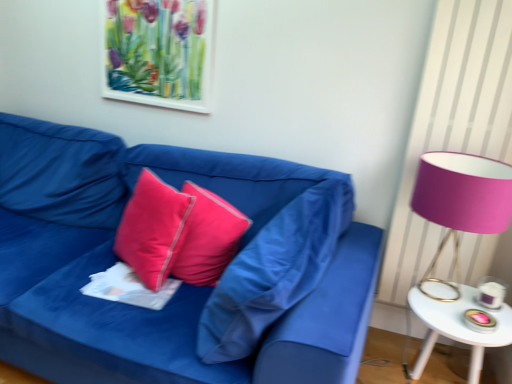
Question: Which direction should I rotate to look at matte pink pillow at center, which appears as the 1th pillow when viewed from the right, — up or down?

Choices:
 (A) down
 (B) up

Answer: (A)

Question: From the image's perspective, would you say satin pink pillow at center, acting as the 1th pillow starting from the left, is positioned over matte blue fabric couch at center?

Choices:
 (A) no
 (B) yes

Answer: (B)

Question: Could you tell me if satin pink pillow at center, the 3th pillow when ordered from right to left, is facing matte blue fabric couch at center?

Choices:
 (A) yes
 (B) no

Answer: (A)

Question: Can you confirm if satin pink pillow at center, acting as the 1th pillow starting from the left, is shorter than matte blue fabric couch at center?

Choices:
 (A) no
 (B) yes

Answer: (B)

Question: Can you confirm if satin pink pillow at center, the 3th pillow when ordered from right to left, is smaller than matte blue fabric couch at center?

Choices:
 (A) no
 (B) yes

Answer: (B)

Question: Considering the relative positions of satin pink pillow at center, the 3th pillow when ordered from right to left, and matte blue fabric couch at center in the image provided, is satin pink pillow at center, the 3th pillow when ordered from right to left, in front of matte blue fabric couch at center?

Choices:
 (A) no
 (B) yes

Answer: (A)

Question: Are satin pink pillow at center, acting as the 1th pillow starting from the left, and matte blue fabric couch at center located far from each other?

Choices:
 (A) yes
 (B) no

Answer: (B)

Question: Is matte pink pillow at center, which appears as the 1th pillow when viewed from the right, placed right next to white glossy side table at right?

Choices:
 (A) no
 (B) yes

Answer: (A)

Question: Is matte pink pillow at center, which appears as the 1th pillow when viewed from the right, facing towards white glossy side table at right?

Choices:
 (A) no
 (B) yes

Answer: (A)

Question: Is matte pink pillow at center, the third pillow when ordered from left to right, at the left side of white glossy side table at right?

Choices:
 (A) yes
 (B) no

Answer: (A)

Question: From the image's perspective, is matte pink pillow at center, which appears as the 1th pillow when viewed from the right, on white glossy side table at right?

Choices:
 (A) no
 (B) yes

Answer: (B)

Question: Considering the relative sizes of matte pink pillow at center, which appears as the 1th pillow when viewed from the right, and white glossy side table at right in the image provided, is matte pink pillow at center, which appears as the 1th pillow when viewed from the right, thinner than white glossy side table at right?

Choices:
 (A) no
 (B) yes

Answer: (B)

Question: Could white glossy side table at right be considered to be inside matte pink pillow at center, which appears as the 1th pillow when viewed from the right?

Choices:
 (A) no
 (B) yes

Answer: (A)

Question: Can you confirm if matte pink pillow at center, which appears as the 1th pillow when viewed from the right, is taller than white paper at center?

Choices:
 (A) no
 (B) yes

Answer: (B)